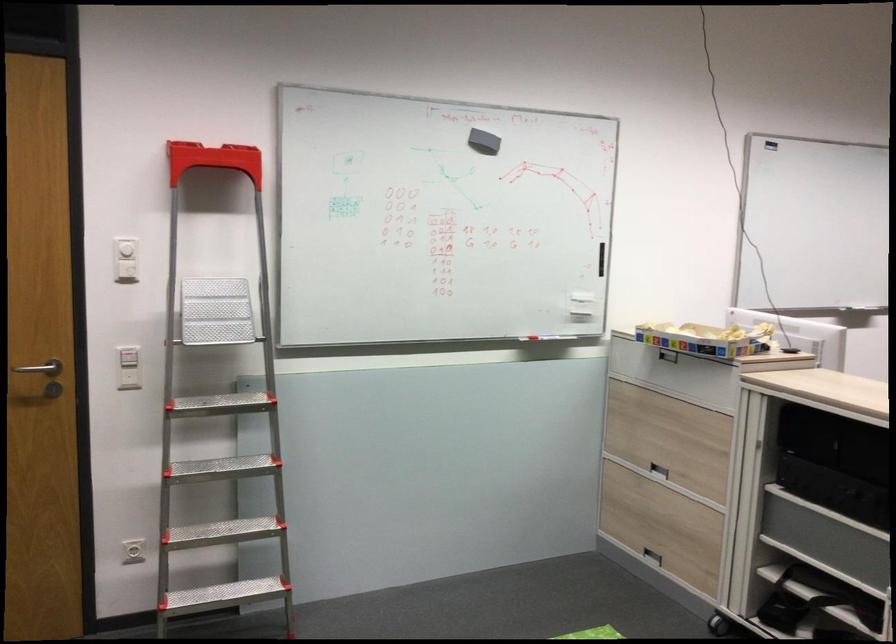
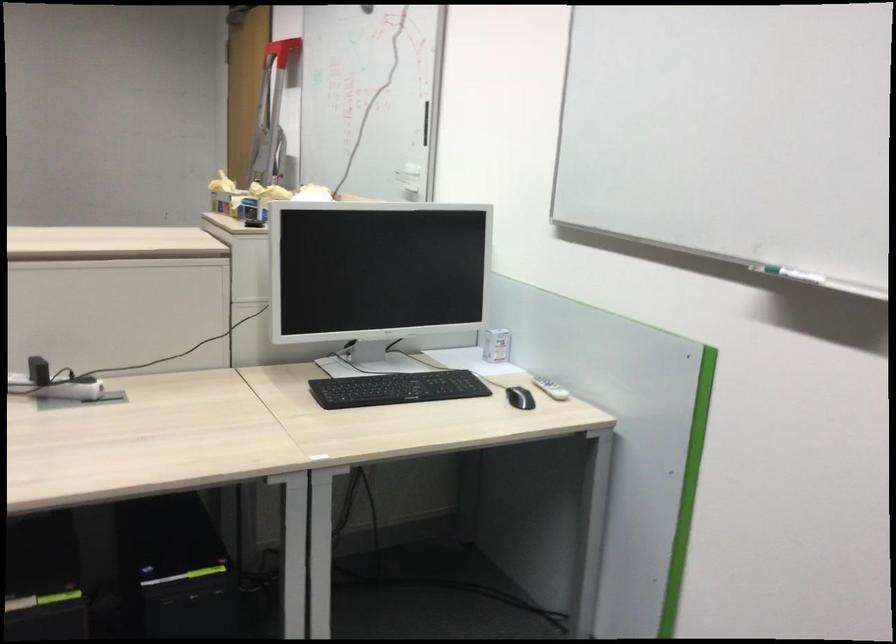
Question: I am providing you with two images of the same scene from different viewpoints. After the viewpoint changes to image2, which objects are now occluded?

Choices:
 (A) green bottle crate
 (B) whiteboard handle
 (C) whiteboard marker
 (D) recessed drawer handle

Answer: (D)